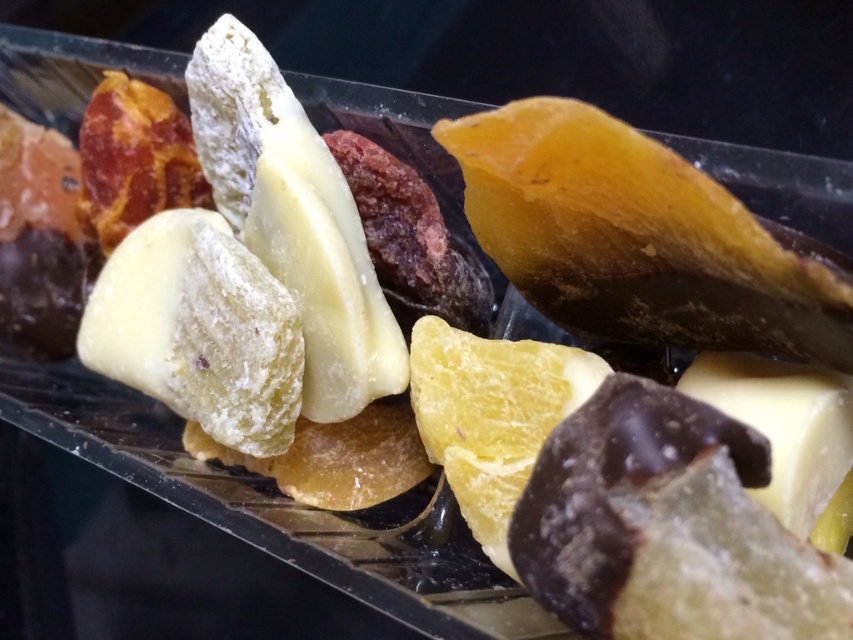
You are looking into the transparent plastic container and see two points labeled as point (x=200, y=369) and point (x=740, y=417). From your perspective, which point is closer to you?

Point (x=740, y=417) is closer to you because point (x=200, y=369) is behind it.

You are a chef preparing a cheese platter and have a limited space on your board. You need to fit both the white crumbly cheese at center and the white creamy cheese at lower right. Which cheese should you place first to maximize space efficiency?

The white creamy cheese at lower right is smaller in size, so placing it first allows more space for the larger white crumbly cheese at center.